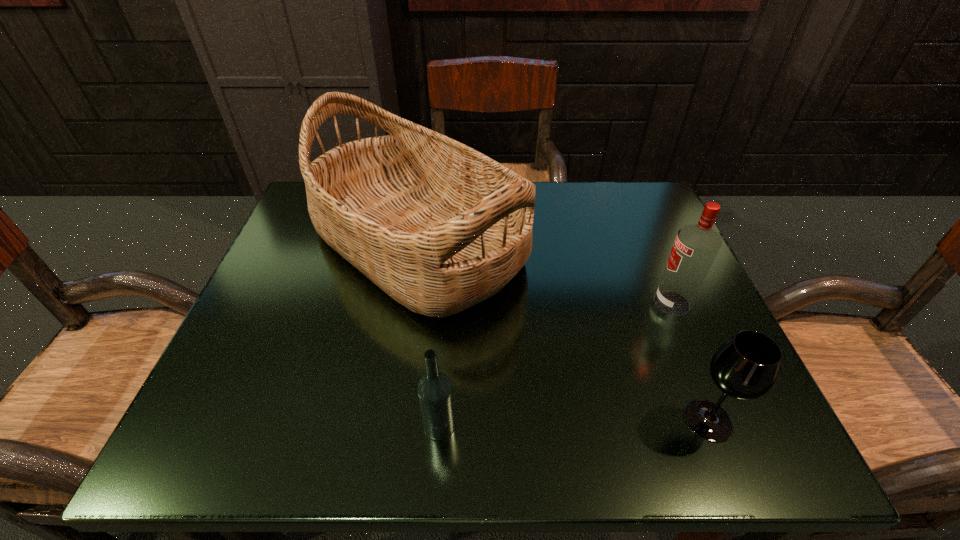
What are the coordinates of `free space between the basket and the second tallest object` in the screenshot? It's located at (544, 273).

The image size is (960, 540). Find the location of `free point between the wineglass and the left vodka`. free point between the wineglass and the left vodka is located at coordinates (574, 423).

Locate an element on the screen. vacant area that lies between the wineglass and the left vodka is located at coordinates click(x=574, y=423).

Identify the location of vacant region between the taller vodka and the wineglass. coord(689,361).

Find the location of a particular element. The image size is (960, 540). free space between the nearer vodka and the wineglass is located at coordinates (574, 423).

Find the location of a particular element. The image size is (960, 540). free space that is in between the shorter vodka and the basket is located at coordinates (428, 334).

Where is `vacant region between the shorter vodka and the wineglass`? The image size is (960, 540). vacant region between the shorter vodka and the wineglass is located at coordinates (x=574, y=423).

Identify which object is the second nearest to the nearer vodka. Please provide its 2D coordinates. Your answer should be formatted as a tuple, i.e. [(x, y)], where the tuple contains the x and y coordinates of a point satisfying the conditions above.

[(745, 367)]

Identify which object is the nearest to the basket. Please provide its 2D coordinates. Your answer should be formatted as a tuple, i.e. [(x, y)], where the tuple contains the x and y coordinates of a point satisfying the conditions above.

[(435, 392)]

Where is `free space that satisfies the following two spatial constraints: 1. on the front side of the wineglass; 2. on the right side of the basket`? The width and height of the screenshot is (960, 540). free space that satisfies the following two spatial constraints: 1. on the front side of the wineglass; 2. on the right side of the basket is located at coordinates (390, 420).